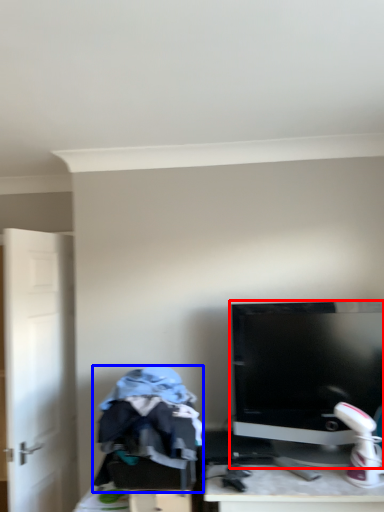
Question: Which object is closer to the camera taking this photo, computer monitor (highlighted by a red box) or clothing (highlighted by a blue box)?

Choices:
 (A) computer monitor
 (B) clothing

Answer: (B)